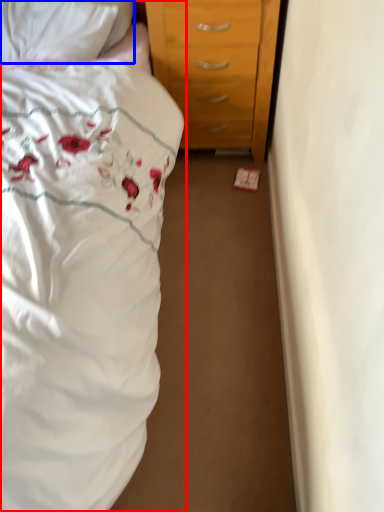
Question: Which object is closer to the camera taking this photo, bed (highlighted by a red box) or pillow (highlighted by a blue box)?

Choices:
 (A) bed
 (B) pillow

Answer: (A)